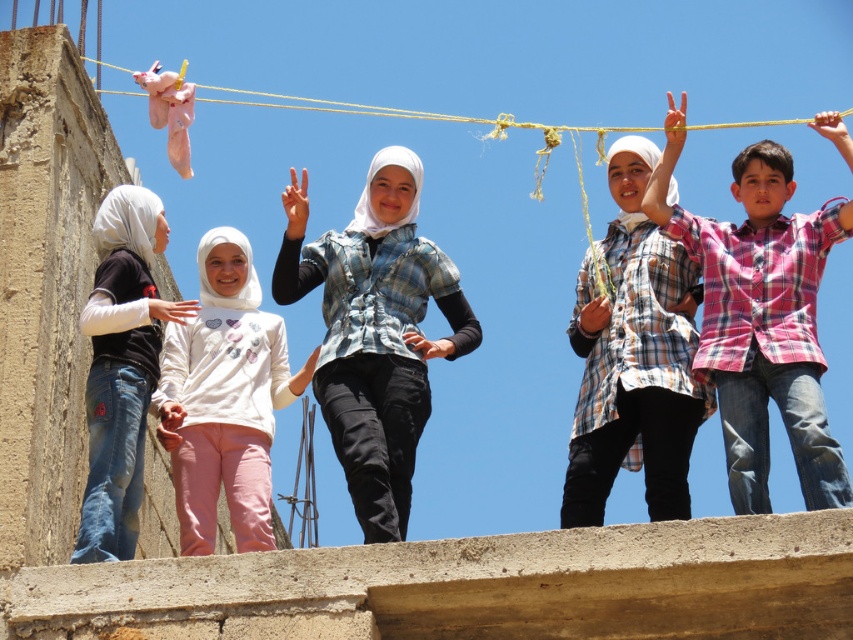
Question: Is plaid cotton shirt at center above white soft sweater at center?

Choices:
 (A) yes
 (B) no

Answer: (A)

Question: Which of these objects is positioned closest to the yellow rope at upper center?

Choices:
 (A) pink plaid shirt at center
 (B) plaid cotton shirt at center
 (C) blue plaid shirt at center

Answer: (A)

Question: Where is blue plaid shirt at center located in relation to plaid cotton shirt at center in the image?

Choices:
 (A) below
 (B) above

Answer: (A)

Question: Estimate the real-world distances between objects in this image. Which object is farther from the plaid cotton shirt at center?

Choices:
 (A) matte black shirt at left
 (B) pink plaid shirt at center
 (C) yellow rope at upper center

Answer: (C)

Question: Which object is positioned farthest from the blue plaid shirt at center?

Choices:
 (A) yellow rope at upper center
 (B) pink plaid shirt at center
 (C) plaid cotton shirt at center

Answer: (A)

Question: Can you confirm if pink plaid shirt at center is wider than plaid cotton shirt at center?

Choices:
 (A) yes
 (B) no

Answer: (A)